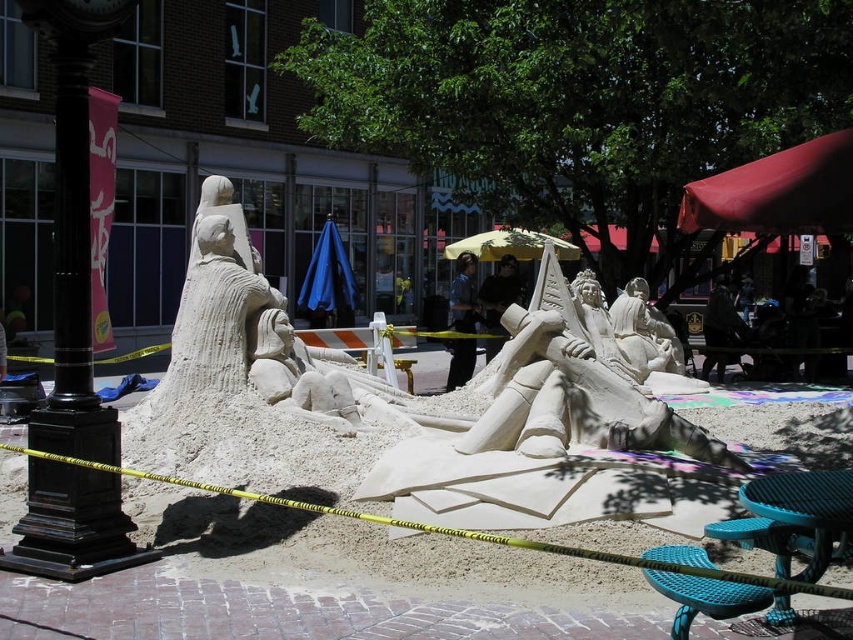
Can you confirm if teal plastic stool at lower right is positioned to the right of yellow fabric umbrella at center?

In fact, teal plastic stool at lower right is to the left of yellow fabric umbrella at center.

Is teal plastic stool at lower right smaller than yellow fabric umbrella at center?

Actually, teal plastic stool at lower right might be larger than yellow fabric umbrella at center.

Who is more forward, (653, 570) or (548, 237)?

Point (653, 570) is more forward.

This screenshot has width=853, height=640. What are the coordinates of `teal plastic stool at lower right` in the screenshot? It's located at (705, 596).

Who is positioned more to the left, blue fabric umbrella at center or yellow fabric umbrella at center?

blue fabric umbrella at center

Is blue fabric umbrella at center positioned in front of yellow fabric umbrella at center?

Yes, it is.

The height and width of the screenshot is (640, 853). I want to click on blue fabric umbrella at center, so [328, 282].

Where is `blue fabric umbrella at center`? This screenshot has width=853, height=640. blue fabric umbrella at center is located at coordinates (328, 282).

Which of these two, white sand sculpture at center or yellow fabric umbrella at center, stands shorter?

white sand sculpture at center is shorter.

Can you confirm if white sand sculpture at center is thinner than yellow fabric umbrella at center?

In fact, white sand sculpture at center might be wider than yellow fabric umbrella at center.

What do you see at coordinates (456, 531) in the screenshot? This screenshot has width=853, height=640. I see `white sand sculpture at center` at bounding box center [456, 531].

Identify the location of white sand sculpture at center. Image resolution: width=853 pixels, height=640 pixels. (456, 531).